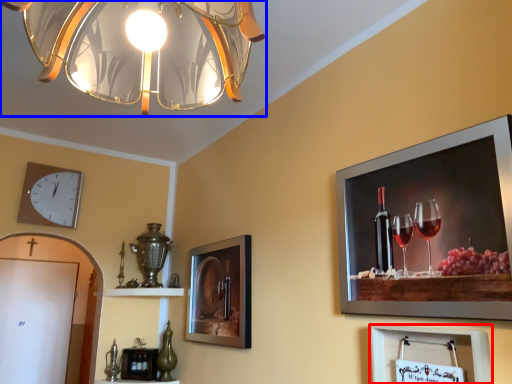
Question: Which of the following is the closest to the observer, picture frame (highlighted by a red box) or lamp (highlighted by a blue box)?

Choices:
 (A) picture frame
 (B) lamp

Answer: (B)